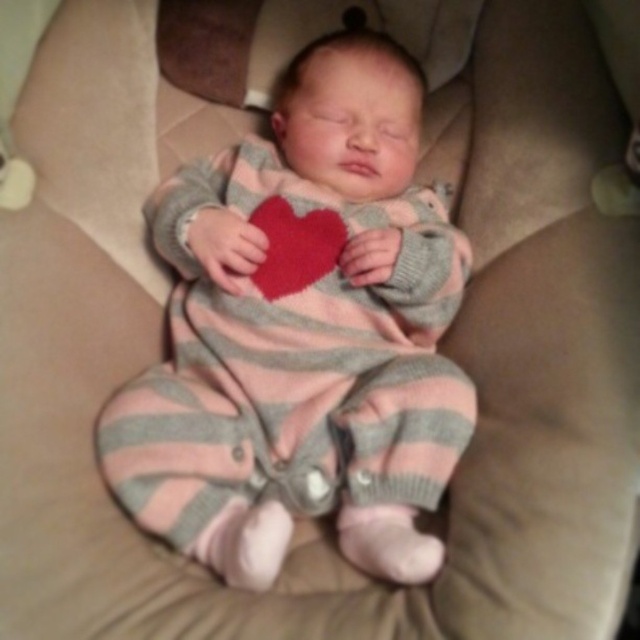
Question: Which of the following is the farthest from the observer?

Choices:
 (A) matte red heart at center
 (B) knitted pink-gray baby at center

Answer: (A)

Question: Is knitted pink-gray baby at center thinner than matte red heart at center?

Choices:
 (A) yes
 (B) no

Answer: (B)

Question: Observing the image, what is the correct spatial positioning of knitted pink-gray baby at center in reference to matte red heart at center?

Choices:
 (A) left
 (B) right

Answer: (B)

Question: Is knitted pink-gray baby at center to the left of matte red heart at center from the viewer's perspective?

Choices:
 (A) yes
 (B) no

Answer: (B)